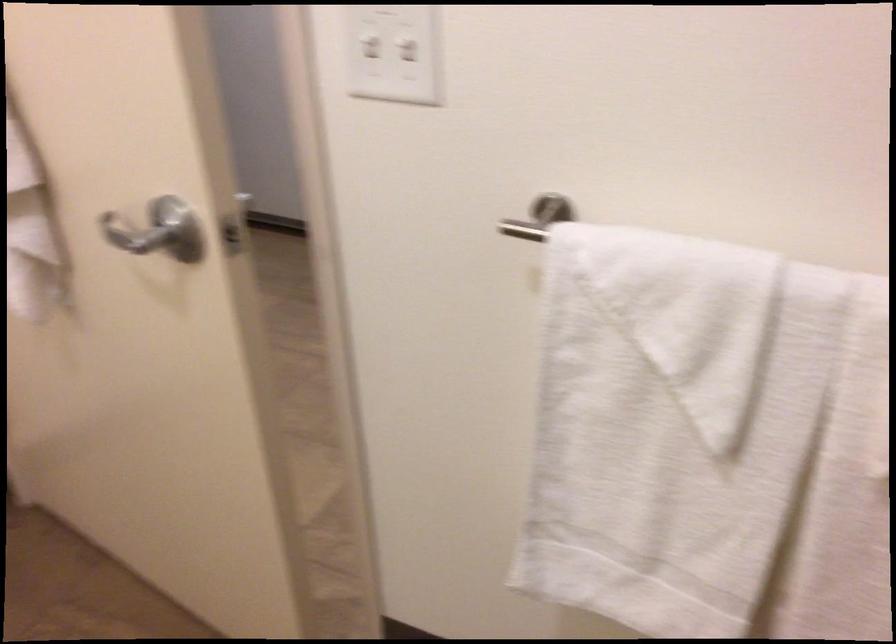
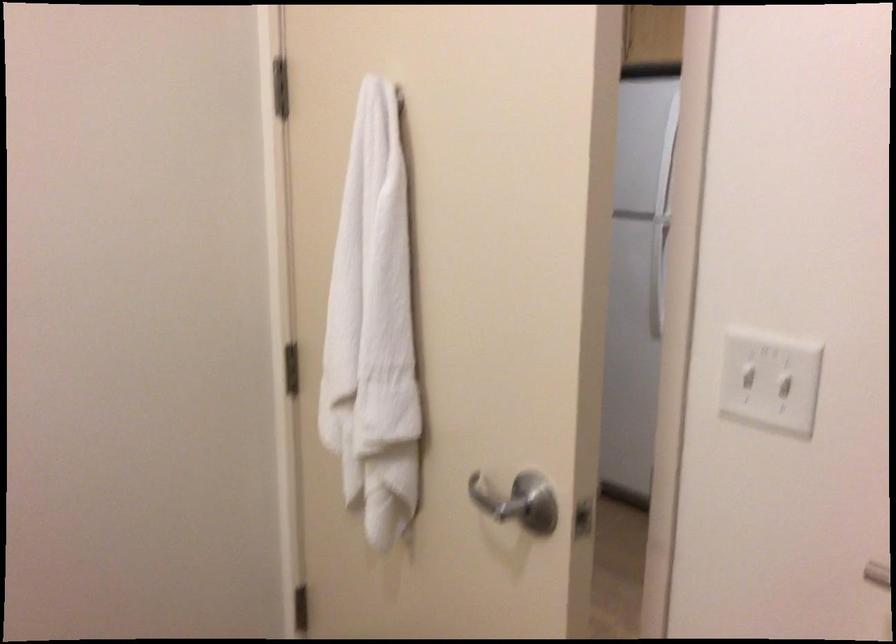
The point at (136,238) is marked in the first image. Where is the corresponding point in the second image?

(494, 500)